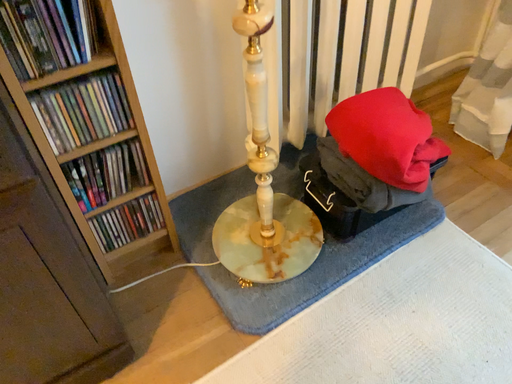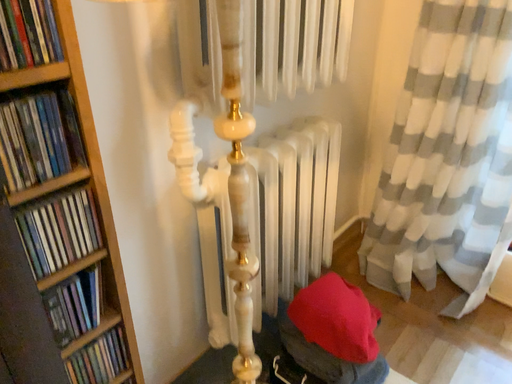
Question: How did the camera likely rotate when shooting the video?

Choices:
 (A) rotated downward
 (B) rotated upward

Answer: (B)